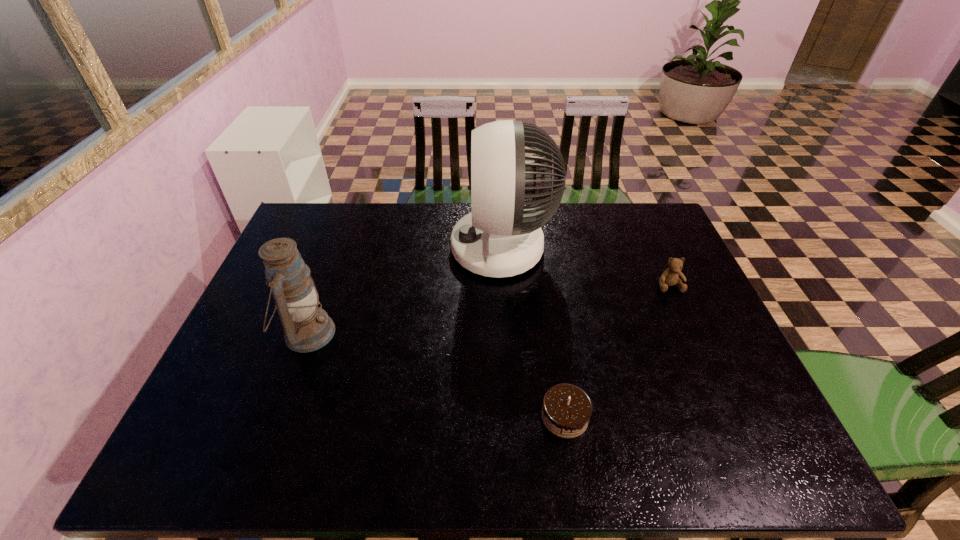
Where is `vacant space at the far right corner`? The image size is (960, 540). vacant space at the far right corner is located at coordinates (626, 226).

The width and height of the screenshot is (960, 540). Find the location of `vacant space at the near right corner`. vacant space at the near right corner is located at coordinates (773, 454).

Find the location of a particular element. Image resolution: width=960 pixels, height=540 pixels. unoccupied position between the fan and the chocolate cake is located at coordinates (534, 332).

Identify the location of empty location between the fan and the leftmost object. Image resolution: width=960 pixels, height=540 pixels. (405, 291).

Where is `vacant area that lies between the chocolate cake and the teddy bear`? The width and height of the screenshot is (960, 540). vacant area that lies between the chocolate cake and the teddy bear is located at coordinates (617, 351).

The width and height of the screenshot is (960, 540). Find the location of `blank region between the chocolate cake and the rightmost object`. blank region between the chocolate cake and the rightmost object is located at coordinates (617, 351).

Where is `vacant space in between the nearest object and the rightmost object`? The image size is (960, 540). vacant space in between the nearest object and the rightmost object is located at coordinates (617, 351).

The width and height of the screenshot is (960, 540). In order to click on free space between the fan and the rightmost object in this screenshot , I will do `click(586, 267)`.

The height and width of the screenshot is (540, 960). In order to click on free area in between the chocolate cake and the rightmost object in this screenshot , I will do `click(617, 351)`.

The width and height of the screenshot is (960, 540). Find the location of `free space between the tallest object and the third farthest object`. free space between the tallest object and the third farthest object is located at coordinates (405, 291).